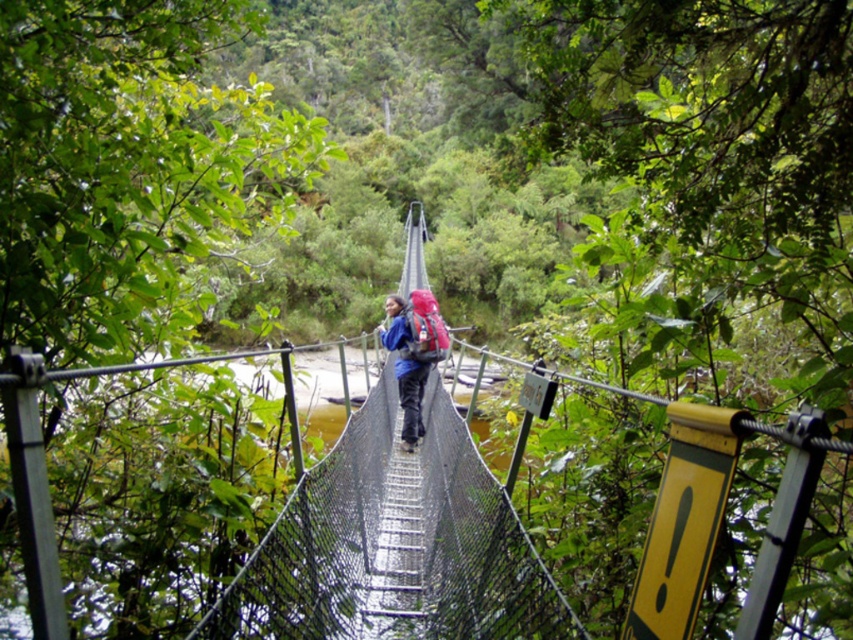
You are a hiker trying to cross the metal mesh bridge at center while carrying the blue fabric backpack at center. Based on their positions, will the backpack interfere with your movement on the bridge?

The metal mesh bridge at center is positioned on the left side of the blue fabric backpack at center, meaning the backpack is on the right side of the bridge. Since the backpack is on the right, it might interfere with your movement on the bridge if the bridge is narrow, especially when navigating turns or obstacles.

You are a hiker trying to cross the metal mesh bridge at center while carrying the blue fabric backpack at center. Can you safely walk across the bridge with your backpack?

The metal mesh bridge at center is bigger than the blue fabric backpack at center, so yes, you can safely walk across the bridge with your backpack as there is enough space.